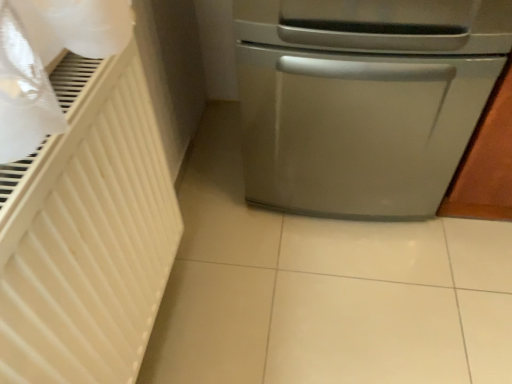
Where is `free space that is to the left of satin silver dishwasher at right`? The image size is (512, 384). free space that is to the left of satin silver dishwasher at right is located at coordinates (218, 176).